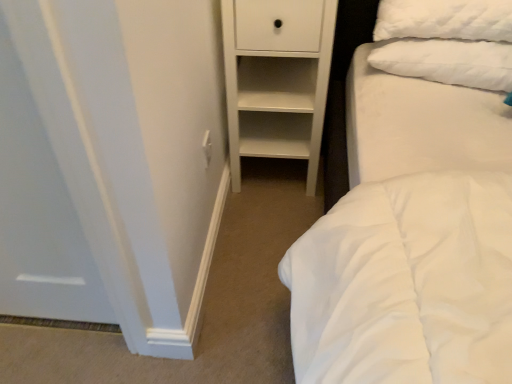
Question: From a real-world perspective, is white plastic electric outlet at center positioned under white fluffy pillow at upper right based on gravity?

Choices:
 (A) no
 (B) yes

Answer: (B)

Question: Is white fluffy pillow at upper right surrounded by white plastic electric outlet at center?

Choices:
 (A) yes
 (B) no

Answer: (B)

Question: Does white plastic electric outlet at center lie in front of white fluffy pillow at upper right?

Choices:
 (A) yes
 (B) no

Answer: (B)

Question: Does white plastic electric outlet at center appear on the left side of white fluffy pillow at upper right?

Choices:
 (A) yes
 (B) no

Answer: (A)

Question: From a real-world perspective, is white plastic electric outlet at center positioned over white fluffy pillow at upper right based on gravity?

Choices:
 (A) no
 (B) yes

Answer: (A)

Question: From their relative heights in the image, would you say white matte chest of drawers at center is taller or shorter than white plastic electric outlet at center?

Choices:
 (A) short
 (B) tall

Answer: (B)

Question: Choose the correct answer: Is white matte chest of drawers at center inside white plastic electric outlet at center or outside it?

Choices:
 (A) inside
 (B) outside

Answer: (B)

Question: Considering the positions of point pos(243,114) and point pos(208,157), is point pos(243,114) closer or farther from the camera than point pos(208,157)?

Choices:
 (A) closer
 (B) farther

Answer: (B)

Question: From a real-world perspective, is white matte chest of drawers at center physically located above or below white plastic electric outlet at center?

Choices:
 (A) above
 (B) below

Answer: (B)

Question: Relative to white fluffy pillow at upper right, is white plastic electric outlet at center in front or behind?

Choices:
 (A) behind
 (B) front

Answer: (A)

Question: From the image's perspective, relative to white fluffy pillow at upper right, is white plastic electric outlet at center above or below?

Choices:
 (A) above
 (B) below

Answer: (B)

Question: Considering the positions of white plastic electric outlet at center and white fluffy pillow at upper right in the image, is white plastic electric outlet at center taller or shorter than white fluffy pillow at upper right?

Choices:
 (A) tall
 (B) short

Answer: (B)

Question: Looking at the image, does white plastic electric outlet at center seem bigger or smaller compared to white fluffy pillow at upper right?

Choices:
 (A) big
 (B) small

Answer: (B)

Question: Is white matte chest of drawers at center inside or outside of white fluffy pillow at upper right?

Choices:
 (A) inside
 (B) outside

Answer: (B)

Question: From the image's perspective, is white matte chest of drawers at center positioned above or below white fluffy pillow at upper right?

Choices:
 (A) below
 (B) above

Answer: (A)